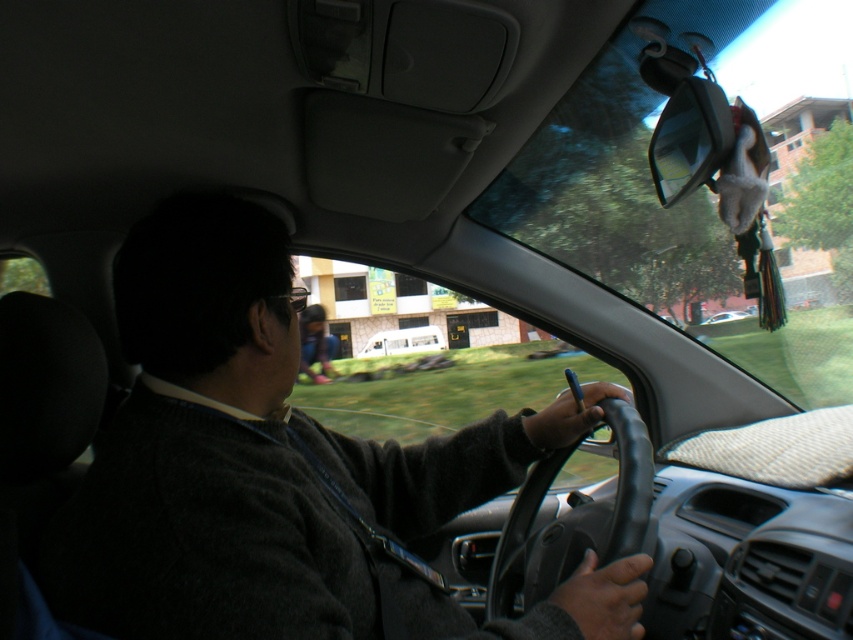
Does dark gray sweater at center appear under black leather steering wheel at center?

No, dark gray sweater at center is not below black leather steering wheel at center.

Who is more forward, (445, 516) or (630, 493)?

Positioned in front is point (630, 493).

Where is `dark gray sweater at center`? dark gray sweater at center is located at coordinates (283, 468).

This screenshot has height=640, width=853. In order to click on white matte van at center in this screenshot , I will do `click(403, 340)`.

Is white matte van at center behind white matte car at center?

Yes, it is behind white matte car at center.

At what (x,y) coordinates should I click in order to perform the action: click on white matte van at center. Please return your answer as a coordinate pair (x, y). The image size is (853, 640). Looking at the image, I should click on (403, 340).

Does black leather steering wheel at center have a smaller size compared to matte black shirt at center?

Correct, black leather steering wheel at center occupies less space than matte black shirt at center.

The width and height of the screenshot is (853, 640). Find the location of `black leather steering wheel at center`. black leather steering wheel at center is located at coordinates (582, 540).

Where is `black leather steering wheel at center`? black leather steering wheel at center is located at coordinates (582, 540).